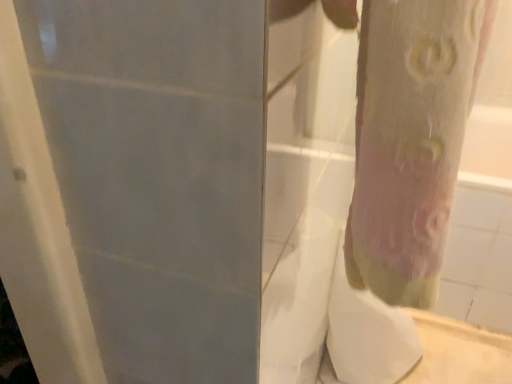
Measure the distance between pink fabric tree trunk at right and camera.

A distance of 10.03 inches exists between pink fabric tree trunk at right and camera.

Describe the element at coordinates (410, 140) in the screenshot. This screenshot has height=384, width=512. I see `pink fabric tree trunk at right` at that location.

Locate an element on the screen. pink fabric tree trunk at right is located at coordinates (410, 140).

At what (x,y) coordinates should I click in order to perform the action: click on white sheer fabric at lower right. Please return your answer as a coordinate pair (x, y). The image size is (512, 384). Looking at the image, I should click on (367, 333).

Describe the element at coordinates (367, 333) in the screenshot. I see `white sheer fabric at lower right` at that location.

Where is `pink fabric tree trunk at right`? The width and height of the screenshot is (512, 384). pink fabric tree trunk at right is located at coordinates (410, 140).

Is pink fabric tree trunk at right at the left side of white sheer fabric at lower right?

Correct, you'll find pink fabric tree trunk at right to the left of white sheer fabric at lower right.

Is pink fabric tree trunk at right further to the viewer compared to white sheer fabric at lower right?

That is False.

Does point (376, 76) lie in front of point (404, 326)?

Yes, point (376, 76) is closer to viewer.

From the image's perspective, is pink fabric tree trunk at right located above white sheer fabric at lower right?

Yes.

From a real-world perspective, between pink fabric tree trunk at right and white sheer fabric at lower right, who is vertically higher?

pink fabric tree trunk at right, from a real-world perspective.

Between pink fabric tree trunk at right and white sheer fabric at lower right, which one has larger width?

white sheer fabric at lower right.

Can you confirm if pink fabric tree trunk at right is shorter than white sheer fabric at lower right?

Yes, pink fabric tree trunk at right is shorter than white sheer fabric at lower right.

Does pink fabric tree trunk at right have a smaller size compared to white sheer fabric at lower right?

Yes.

Does pink fabric tree trunk at right contain white sheer fabric at lower right?

No, pink fabric tree trunk at right does not contain white sheer fabric at lower right.

Is pink fabric tree trunk at right touching white sheer fabric at lower right?

No, pink fabric tree trunk at right is not beside white sheer fabric at lower right.

Is pink fabric tree trunk at right oriented away from white sheer fabric at lower right?

No, pink fabric tree trunk at right is not facing away from white sheer fabric at lower right.

Where is `tree trunk above the white sheer fabric at lower right (from the image's perspective)`? tree trunk above the white sheer fabric at lower right (from the image's perspective) is located at coordinates (410, 140).

Based on their positions, is white sheer fabric at lower right located to the left or right of pink fabric tree trunk at right?

white sheer fabric at lower right is positioned on pink fabric tree trunk at right's right side.

Is white sheer fabric at lower right in front of or behind pink fabric tree trunk at right in the image?

Clearly, white sheer fabric at lower right is behind pink fabric tree trunk at right.

Does point (334, 322) lie in front of point (398, 62)?

That is False.

Consider the image. From the image's perspective, which object appears higher, white sheer fabric at lower right or pink fabric tree trunk at right?

pink fabric tree trunk at right, from the image's perspective.

From a real-world perspective, is white sheer fabric at lower right physically located above or below pink fabric tree trunk at right?

white sheer fabric at lower right is situated lower than pink fabric tree trunk at right in the real world.

Based on the photo, does white sheer fabric at lower right have a greater width compared to pink fabric tree trunk at right?

Yes.

From their relative heights in the image, would you say white sheer fabric at lower right is taller or shorter than pink fabric tree trunk at right?

white sheer fabric at lower right is taller than pink fabric tree trunk at right.

Based on the photo, between white sheer fabric at lower right and pink fabric tree trunk at right, which one has smaller size?

pink fabric tree trunk at right is smaller.

Is white sheer fabric at lower right outside of pink fabric tree trunk at right?

Absolutely, white sheer fabric at lower right is external to pink fabric tree trunk at right.

Is white sheer fabric at lower right placed right next to pink fabric tree trunk at right?

No, white sheer fabric at lower right is not making contact with pink fabric tree trunk at right.

Is white sheer fabric at lower right aimed at pink fabric tree trunk at right?

No, white sheer fabric at lower right is not facing towards pink fabric tree trunk at right.

Can you tell me how much white sheer fabric at lower right and pink fabric tree trunk at right differ in facing direction?

white sheer fabric at lower right and pink fabric tree trunk at right are facing 0.132 degrees away from each other.

This screenshot has height=384, width=512. I want to click on toilet paper located underneath the pink fabric tree trunk at right (from a real-world perspective), so click(367, 333).

Where is `toilet paper located underneath the pink fabric tree trunk at right (from a real-world perspective)`? This screenshot has width=512, height=384. toilet paper located underneath the pink fabric tree trunk at right (from a real-world perspective) is located at coordinates (367, 333).

Where is `toilet paper to the right of pink fabric tree trunk at right`? The height and width of the screenshot is (384, 512). toilet paper to the right of pink fabric tree trunk at right is located at coordinates (367, 333).